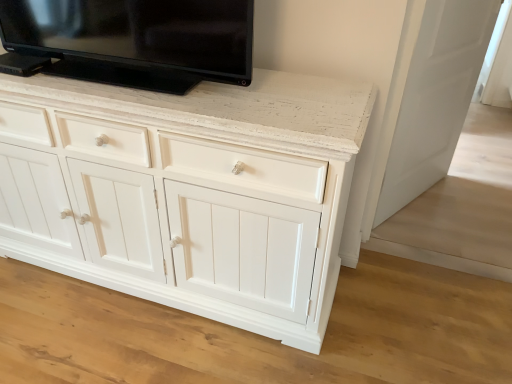
Identify the location of empty space that is to the right of white glossy door at right. This screenshot has height=384, width=512. (474, 198).